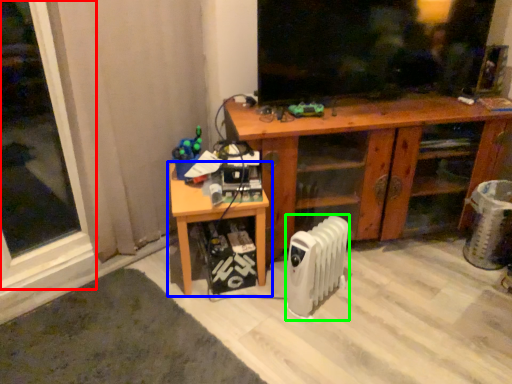
Question: Which is farther away from window (highlighted by a red box)? table (highlighted by a blue box) or radiator (highlighted by a green box)?

Choices:
 (A) table
 (B) radiator

Answer: (B)